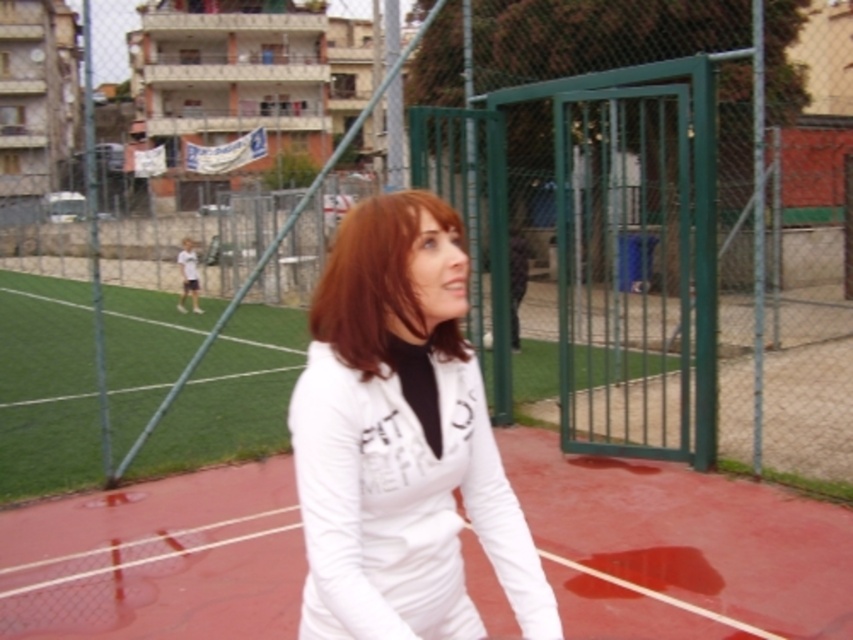
Question: Considering the real-world distances, which object is farthest from the white fabric tennis court at center?

Choices:
 (A) white matte jacket at center
 (B) shiny brown hair at center

Answer: (B)

Question: Which point is closer to the camera?

Choices:
 (A) (354, 358)
 (B) (315, 600)

Answer: (A)

Question: Can you confirm if white fabric tennis court at center is positioned to the right of white matte jacket at center?

Choices:
 (A) no
 (B) yes

Answer: (A)

Question: Can you confirm if white fabric tennis court at center is thinner than white matte jacket at center?

Choices:
 (A) yes
 (B) no

Answer: (B)

Question: Considering the real-world distances, which object is closest to the white matte jacket at center?

Choices:
 (A) white fabric tennis court at center
 (B) shiny brown hair at center

Answer: (B)

Question: Does white fabric tennis court at center lie in front of white matte jacket at center?

Choices:
 (A) yes
 (B) no

Answer: (B)